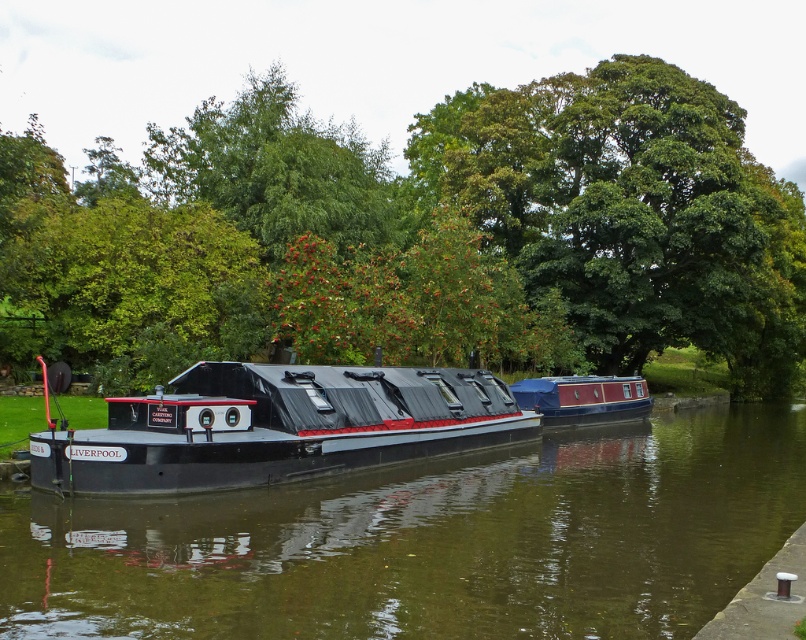
How far apart are green leafy tree at center and black glossy boat at center?

green leafy tree at center is 65.46 feet away from black glossy boat at center.

Is green leafy tree at center taller than black glossy boat at center?

Indeed, green leafy tree at center has a greater height compared to black glossy boat at center.

Image resolution: width=806 pixels, height=640 pixels. I want to click on green leafy tree at center, so click(416, 236).

Which of these two, green leafy tree at center or black matte barge at center, stands taller?

green leafy tree at center is taller.

Does green leafy tree at center have a smaller size compared to black matte barge at center?

No, green leafy tree at center is not smaller than black matte barge at center.

Between point (586, 93) and point (226, 419), which one is positioned in front?

Positioned in front is point (226, 419).

In order to click on green leafy tree at center in this screenshot , I will do `click(416, 236)`.

Does black glossy boat at center have a lesser width compared to blue painted wooden boat at center?

Incorrect, black glossy boat at center's width is not less than blue painted wooden boat at center's.

Who is positioned more to the left, black glossy boat at center or blue painted wooden boat at center?

black glossy boat at center is more to the left.

Which is behind, point (368, 536) or point (534, 385)?

Positioned behind is point (534, 385).

The height and width of the screenshot is (640, 806). I want to click on black glossy boat at center, so click(429, 541).